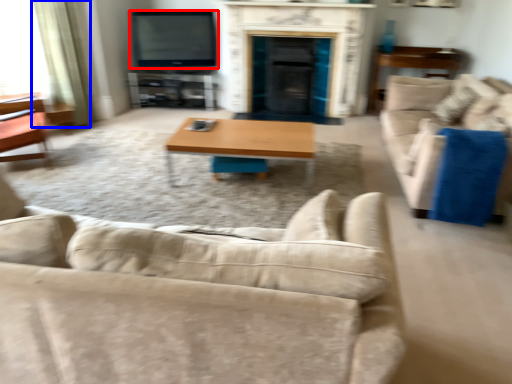
Question: Which object is further to the camera taking this photo, television (highlighted by a red box) or curtain (highlighted by a blue box)?

Choices:
 (A) television
 (B) curtain

Answer: (A)